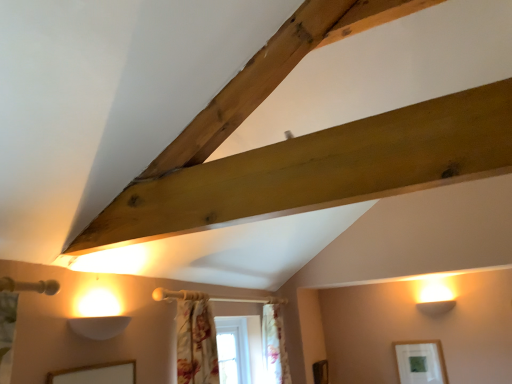
Question: Is floral fabric curtain at center, the 2th curtain positioned from the front, bigger or smaller than matte white picture frame at lower right?

Choices:
 (A) big
 (B) small

Answer: (A)

Question: From the image's perspective, is floral fabric curtain at center, the 2th curtain positioned from the front, above or below matte white picture frame at lower right?

Choices:
 (A) below
 (B) above

Answer: (B)

Question: Estimate the real-world distances between objects in this image. Which object is farther from the matte white picture frame at lower right?

Choices:
 (A) white painted wood window at center
 (B) floral fabric curtain at center, which ranks as the 1th curtain in right-to-left order
 (C) floral fabric curtain at lower center, which is the first curtain from front to back

Answer: (C)

Question: Based on their relative distances, which object is farther from the matte white picture frame at lower right?

Choices:
 (A) floral fabric curtain at center, the 2th curtain positioned from the front
 (B) white painted wood window at center
 (C) floral fabric curtain at lower center, placed as the 2th curtain when sorted from back to front

Answer: (C)